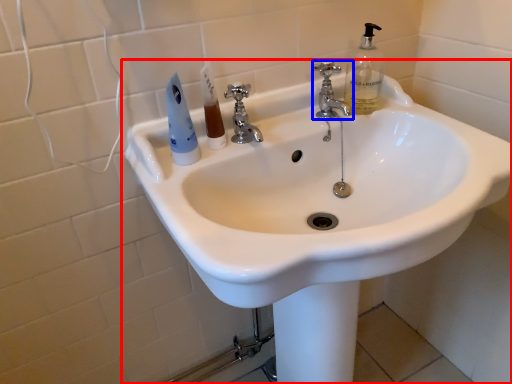
Question: Which of the following is the farthest to the observer, sink (highlighted by a red box) or tap (highlighted by a blue box)?

Choices:
 (A) sink
 (B) tap

Answer: (B)